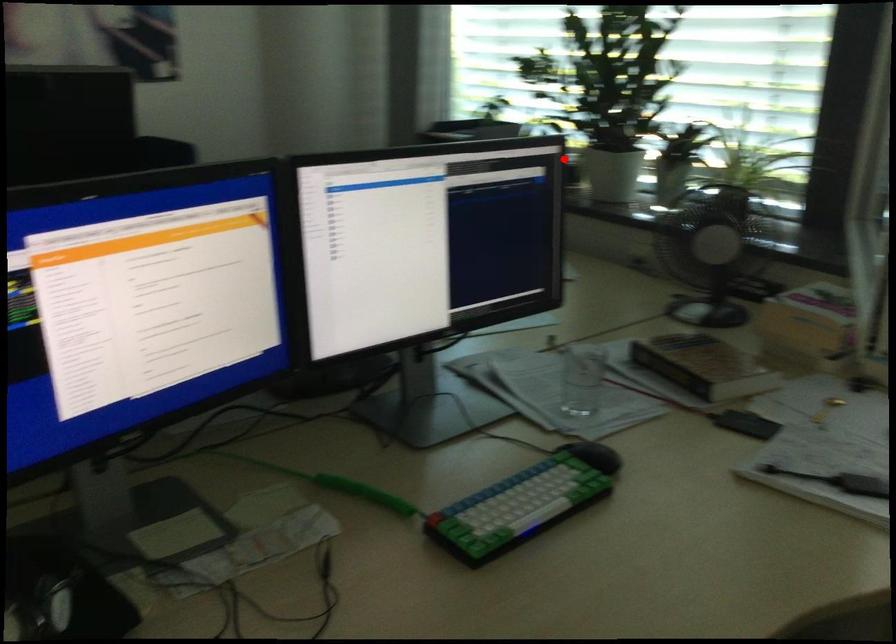
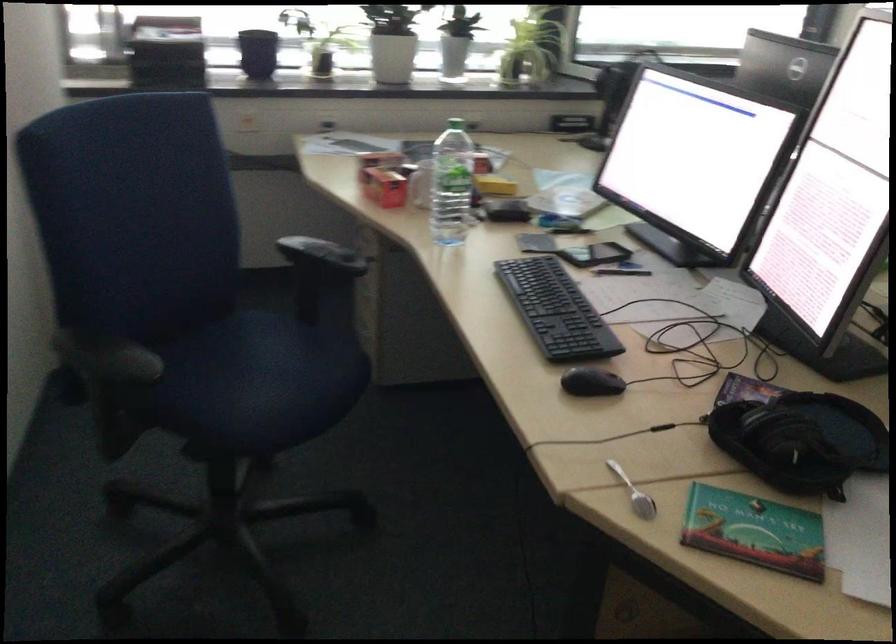
Question: I am providing you with two images of the same scene from different viewpoints. A red point is marked on the first image. At the location where the point appears in image 1, is it still visible in image 2?

Choices:
 (A) Yes
 (B) No

Answer: (A)